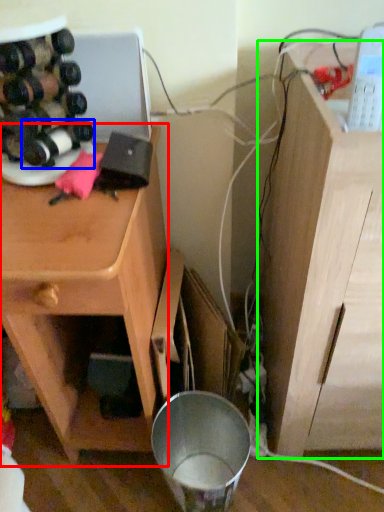
Question: Which object is positioned closest to cabinetry (highlighted by a red box)? Select from wine bottle (highlighted by a blue box) and vanity (highlighted by a green box).

Choices:
 (A) wine bottle
 (B) vanity

Answer: (A)